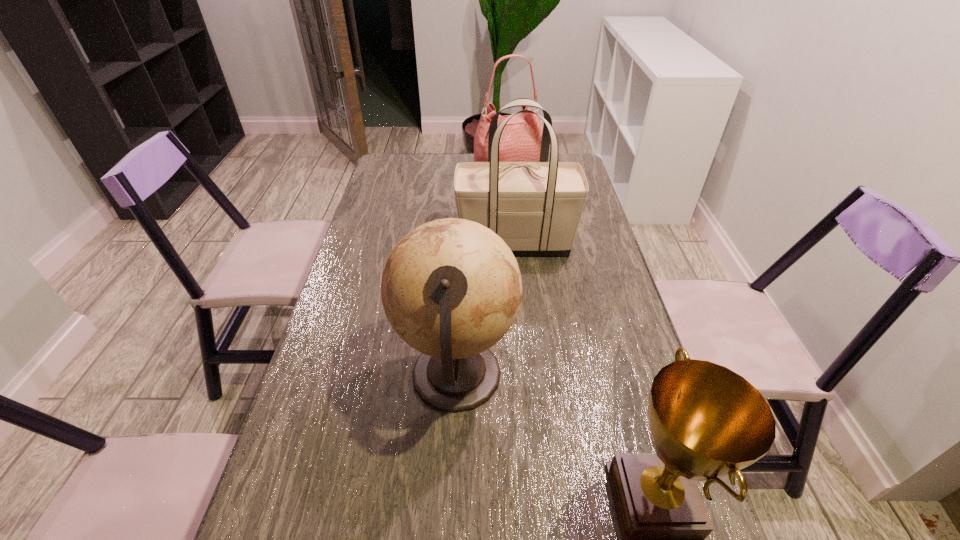
Locate an element on the screen. This screenshot has width=960, height=540. shopping bag situated at the right edge is located at coordinates click(535, 207).

The height and width of the screenshot is (540, 960). Identify the location of object that is at the far right corner. (521, 138).

In the image, there is a desktop. At what (x,y) coordinates should I click in order to perform the action: click on vacant region at the far edge. Please return your answer as a coordinate pair (x, y). The image size is (960, 540). Looking at the image, I should click on (438, 159).

Identify the location of free space at the left edge of the desktop. (328, 497).

Where is `free spot at the right edge of the desktop`? free spot at the right edge of the desktop is located at coordinates (588, 265).

This screenshot has height=540, width=960. In order to click on vacant space at the far left corner of the desktop in this screenshot , I will do `click(380, 170)`.

Image resolution: width=960 pixels, height=540 pixels. What are the coordinates of `vacant space at the far right corner` in the screenshot? It's located at (562, 159).

I want to click on object identified as the third closest to the shopping bag, so click(706, 421).

Where is `object that ranks as the second closest to the shortest object`? object that ranks as the second closest to the shortest object is located at coordinates (535, 207).

This screenshot has width=960, height=540. Find the location of `vacant area in the image that satisfies the following two spatial constraints: 1. on the front side of the handbag; 2. on the front-facing side of the globe`. vacant area in the image that satisfies the following two spatial constraints: 1. on the front side of the handbag; 2. on the front-facing side of the globe is located at coordinates tap(526, 376).